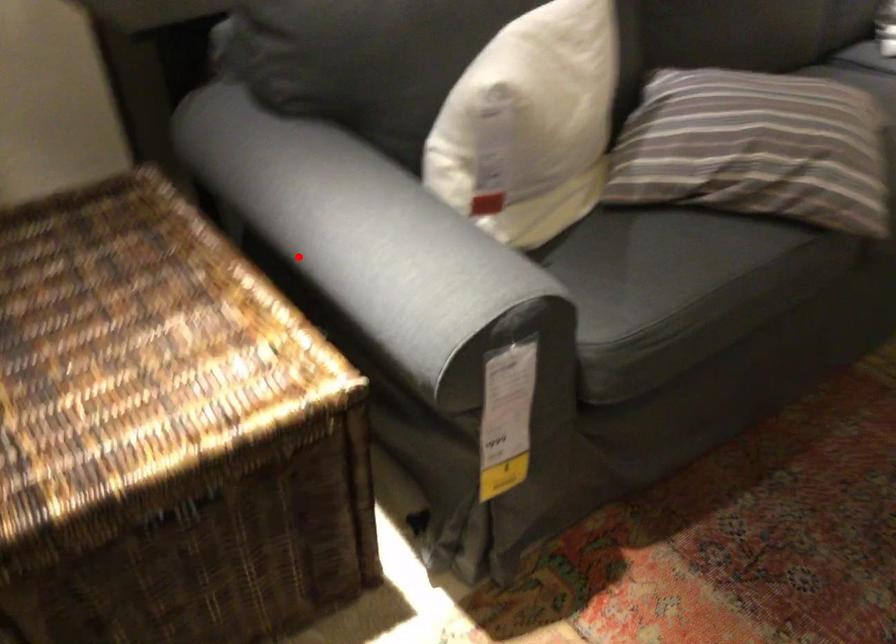
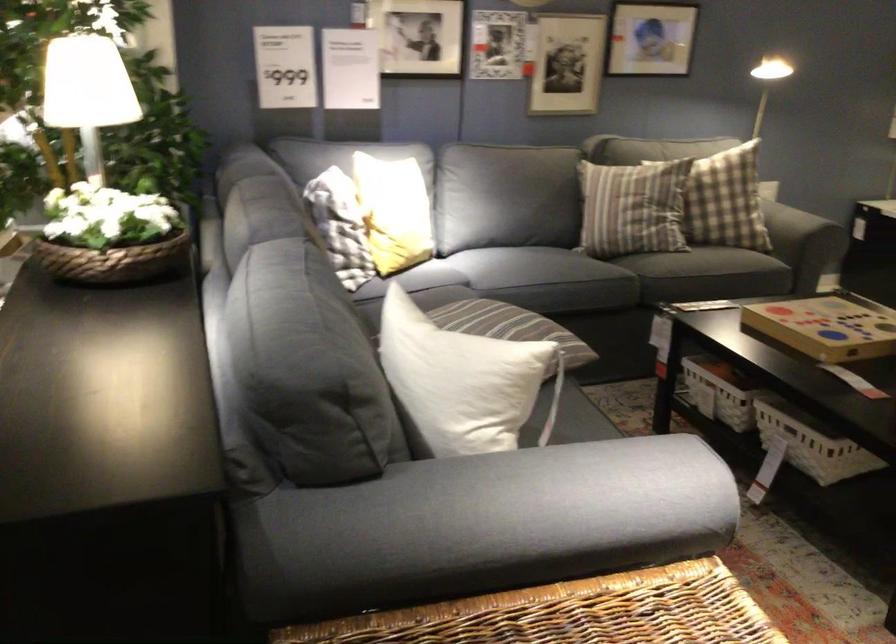
The point at the highlighted location is marked in the first image. Where is the corresponding point in the second image?

(528, 500)